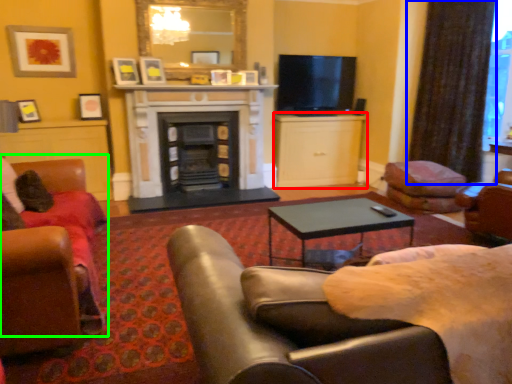
Question: Estimate the real-world distances between objects in this image. Which object is closer to cabinetry (highlighted by a red box), curtain (highlighted by a blue box) or chair (highlighted by a green box)?

Choices:
 (A) curtain
 (B) chair

Answer: (A)